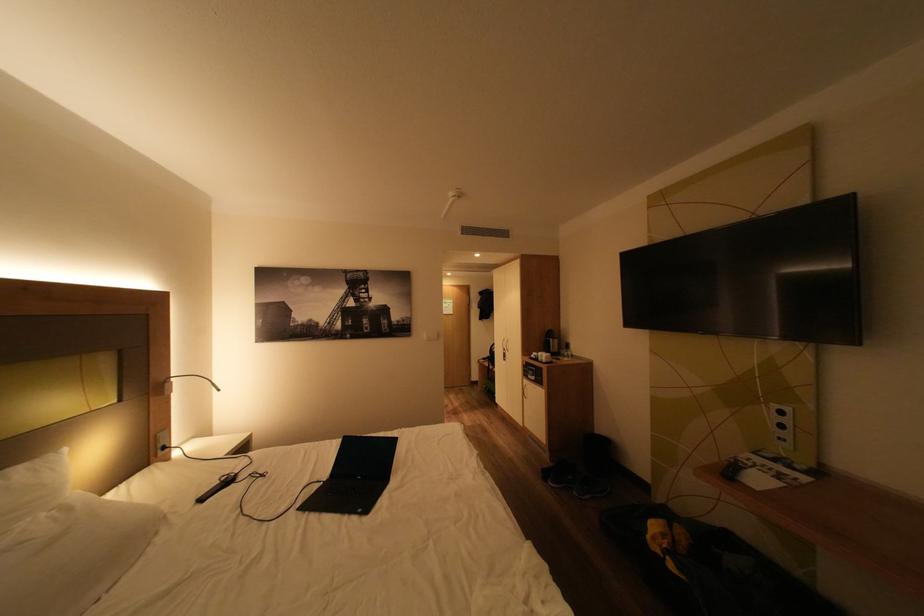
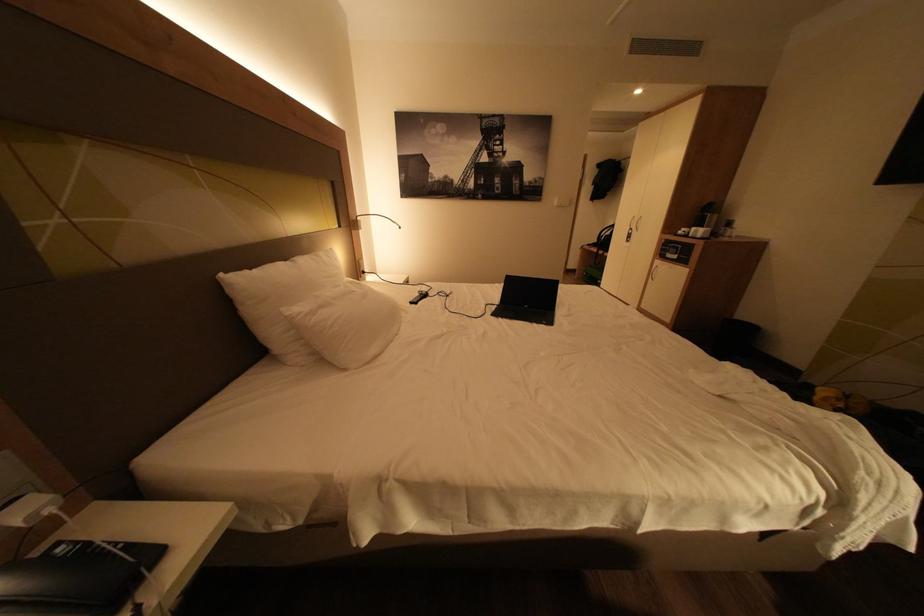
Question: The images are taken continuously from a first-person perspective. In which direction is your viewpoint rotating?

Choices:
 (A) Left
 (B) Right
 (C) Up
 (D) Down

Answer: (D)